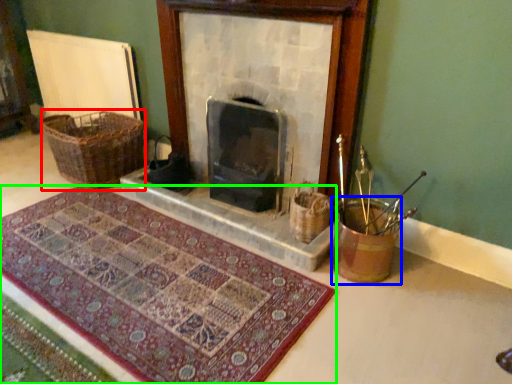
Question: Which object is positioned closest to basket (highlighted by a red box)? Select from basket container (highlighted by a blue box) and mat (highlighted by a green box).

Choices:
 (A) basket container
 (B) mat

Answer: (B)